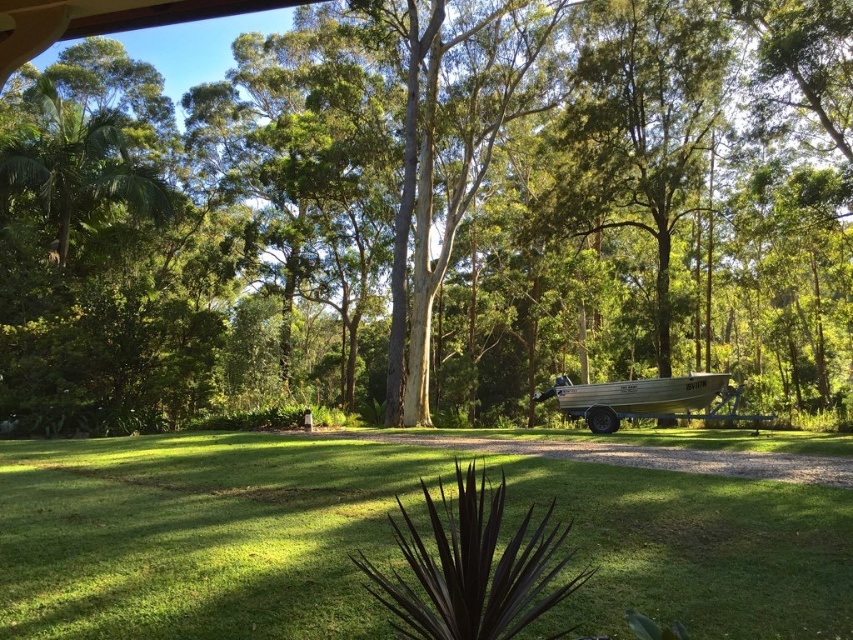
From the picture: You are standing in the backyard and want to take a photo of the green leafy tree at center and the green grassy at center. Which object will appear larger in the photo?

The green leafy tree at center will appear larger in the photo because it is closer to the viewer than the green grassy at center.

You are planning to set up a picnic area in the backyard. You want to ensure there is enough space between the green leafy tree at center and the green grassy at center for a picnic blanket. Can you determine if there is sufficient space between them?

The green leafy tree at center has a larger size compared to green grassy at center, so there is enough space between them for a picnic blanket.

You are planning to take a photo of both the green leafy tree at center and the silver aluminum boat at center. Which object should you focus on first if you want to capture both in the same frame without moving the camera?

The green leafy tree at center is larger in size than the silver aluminum boat at center, so you should focus on the larger object first to ensure it fills the frame appropriately while still including the smaller boat in the background.